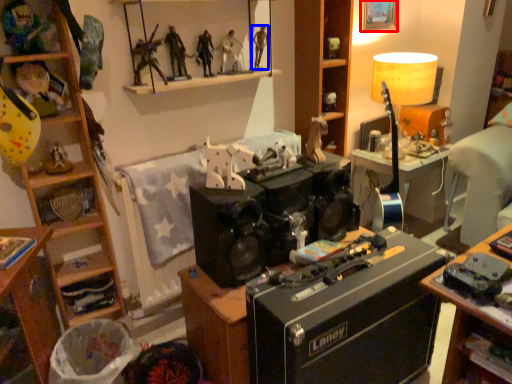
Question: Which object is closer to the camera taking this photo, picture frame (highlighted by a red box) or person (highlighted by a blue box)?

Choices:
 (A) picture frame
 (B) person

Answer: (B)